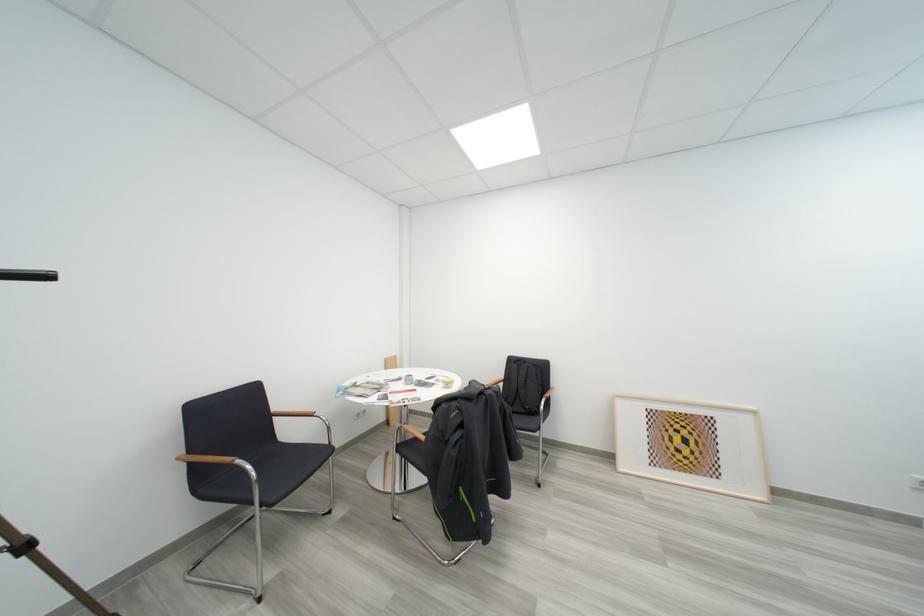
You are a GUI agent. You are given a task and a screenshot of the screen. Output one action in this format:
    pyautogui.click(x=<x>, y=<y>)
    Task: Click on the dark chair sitting surface
    
    Given the screenshot: What is the action you would take?
    pyautogui.click(x=283, y=469)